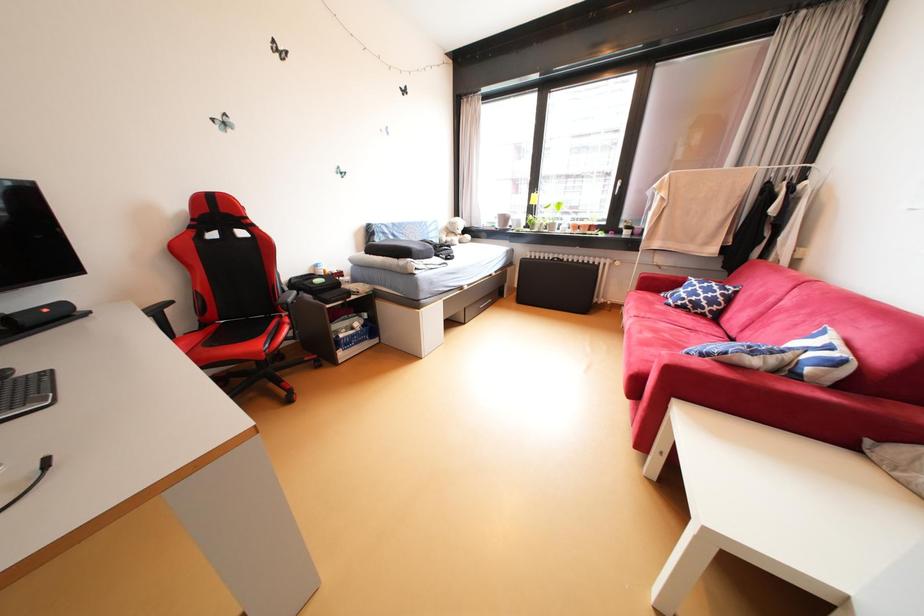
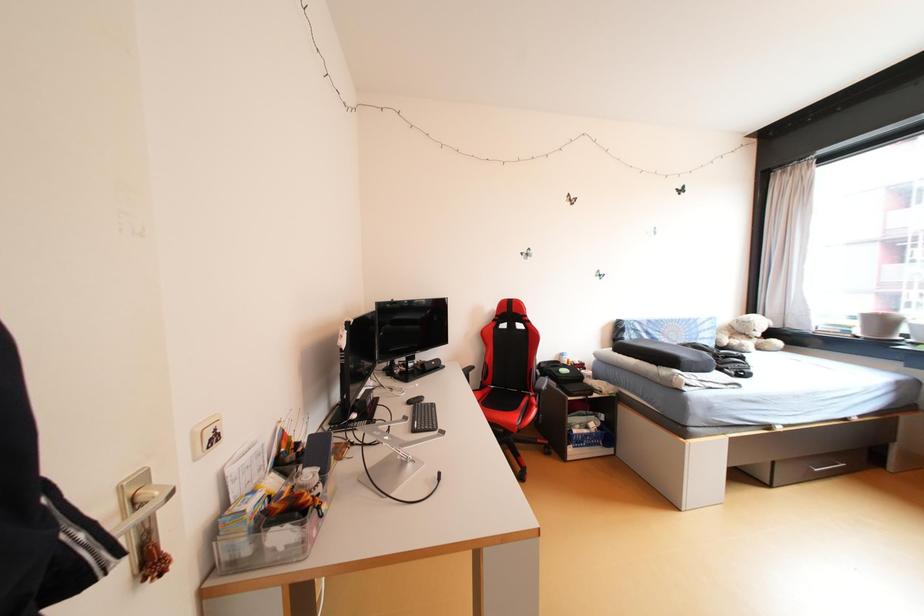
Question: The camera is either moving clockwise (left) or counter-clockwise (right) around the object. The first image is from the beginning of the video and the second image is from the end. Is the camera moving left or right when shooting the video?

Choices:
 (A) Left
 (B) Right

Answer: (B)